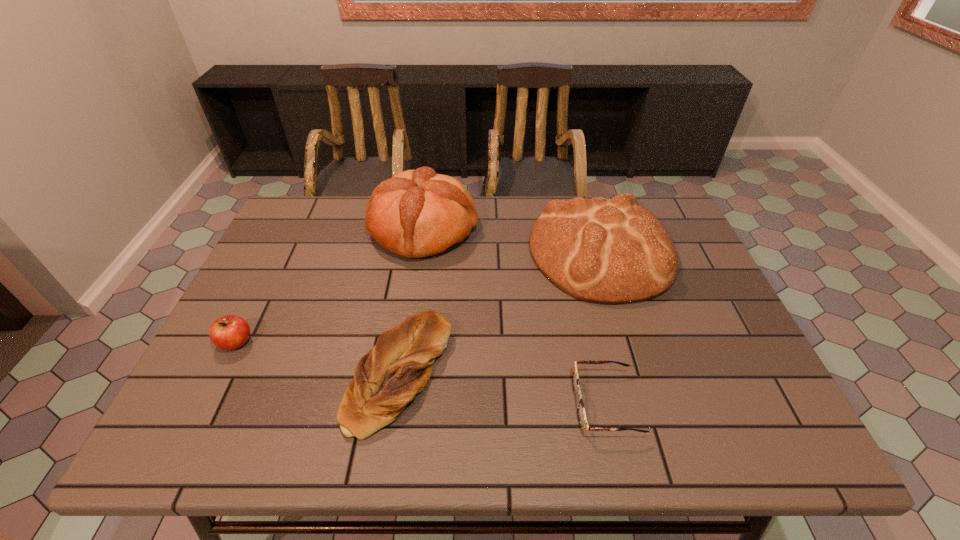
The image size is (960, 540). Identify the location of free point located 0.190m on the frame of the shortest object. (485, 404).

Locate an element on the screen. bread situated at the near edge is located at coordinates (399, 366).

Identify the location of spectacles that is at the near edge. The image size is (960, 540). (581, 413).

You are a GUI agent. You are given a task and a screenshot of the screen. Output one action in this format:
    pyautogui.click(x=<x>, y=<y>)
    Task: Click on the object present at the left edge
    The width and height of the screenshot is (960, 540).
    Given the screenshot: What is the action you would take?
    pyautogui.click(x=229, y=332)

Identify the location of object situated at the right edge. (612, 251).

At what (x,y) coordinates should I click in order to perform the action: click on object that is at the far right corner. Please return your answer as a coordinate pair (x, y). The image size is (960, 540). Looking at the image, I should click on (612, 251).

Find the location of `free location at the far edge of the desktop`. free location at the far edge of the desktop is located at coordinates (492, 216).

Where is `vacant space at the left edge of the desktop`? vacant space at the left edge of the desktop is located at coordinates (280, 301).

In the image, there is a desktop. At what (x,y) coordinates should I click in order to perform the action: click on free space at the right edge. Please return your answer as a coordinate pair (x, y). This screenshot has height=540, width=960. Looking at the image, I should click on (695, 380).

Identify the location of vacant space at the near left corner of the desktop. The height and width of the screenshot is (540, 960). (175, 423).